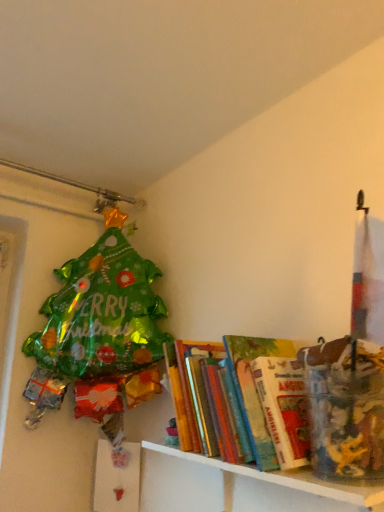
Question: Looking at the image, does white glossy shelf at lower right seem bigger or smaller compared to hardcover books at center?

Choices:
 (A) small
 (B) big

Answer: (B)

Question: Is white glossy shelf at lower right inside or outside of hardcover books at center?

Choices:
 (A) inside
 (B) outside

Answer: (B)

Question: From the image's perspective, is white glossy shelf at lower right located above or below hardcover books at center?

Choices:
 (A) below
 (B) above

Answer: (A)

Question: Considering the positions of hardcover books at center and white glossy shelf at lower right in the image, is hardcover books at center wider or thinner than white glossy shelf at lower right?

Choices:
 (A) wide
 (B) thin

Answer: (A)

Question: Considering the positions of point (284, 375) and point (200, 457), is point (284, 375) closer or farther from the camera than point (200, 457)?

Choices:
 (A) closer
 (B) farther

Answer: (A)

Question: From the image's perspective, is hardcover books at center positioned above or below white glossy shelf at lower right?

Choices:
 (A) below
 (B) above

Answer: (B)

Question: In terms of height, does hardcover books at center look taller or shorter compared to white glossy shelf at lower right?

Choices:
 (A) short
 (B) tall

Answer: (B)